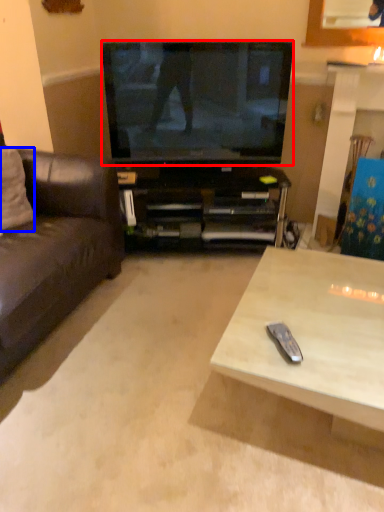
Question: Which point is further to the camera, television (highlighted by a red box) or pillow (highlighted by a blue box)?

Choices:
 (A) television
 (B) pillow

Answer: (A)